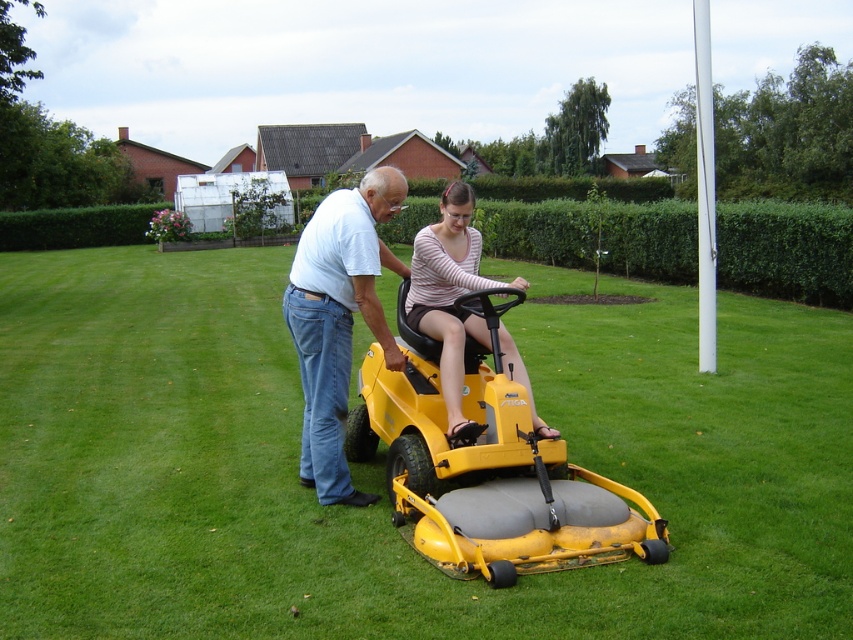
Question: Can you confirm if yellow matte lawn mower at center is wider than striped cotton shirt at center?

Choices:
 (A) no
 (B) yes

Answer: (B)

Question: Among these points, which one is nearest to the camera?

Choices:
 (A) (418, 480)
 (B) (521, 284)

Answer: (A)

Question: Can you confirm if green grass at center is thinner than white matte shirt at center?

Choices:
 (A) yes
 (B) no

Answer: (B)

Question: Which point is closer to the camera?

Choices:
 (A) pos(265,323)
 (B) pos(310,324)
 (C) pos(498,340)
 (D) pos(440,291)

Answer: (C)

Question: Estimate the real-world distances between objects in this image. Which object is closer to the striped cotton shirt at center?

Choices:
 (A) yellow matte lawn mower at center
 (B) green grass at center
 (C) white matte shirt at center

Answer: (C)

Question: Does green grass at center have a lesser width compared to white matte shirt at center?

Choices:
 (A) yes
 (B) no

Answer: (B)